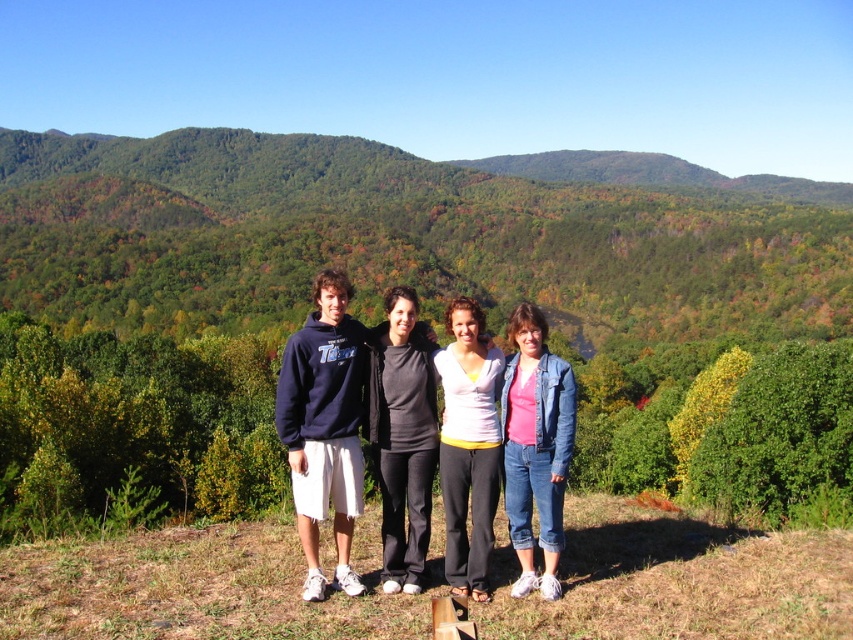
Who is taller, pink denim jacket at lower right or dark blue hoodie at center?

Standing taller between the two is dark blue hoodie at center.

Measure the distance between point [531,356] and camera.

The distance of point [531,356] from camera is 29.39 feet.

This screenshot has width=853, height=640. In order to click on pink denim jacket at lower right in this screenshot , I will do `click(535, 448)`.

Does green leafy hillside at center have a larger size compared to pink denim jacket at lower right?

Indeed, green leafy hillside at center has a larger size compared to pink denim jacket at lower right.

What do you see at coordinates (393, 236) in the screenshot? I see `green leafy hillside at center` at bounding box center [393, 236].

The width and height of the screenshot is (853, 640). I want to click on green leafy hillside at center, so click(393, 236).

I want to click on green leafy hillside at center, so click(x=393, y=236).

Does point (752, 294) lie in front of point (384, 420)?

No, it is not.

Does green leafy hillside at center have a lesser width compared to black matte pants at center?

No, green leafy hillside at center is not thinner than black matte pants at center.

Locate an element on the screen. green leafy hillside at center is located at coordinates click(x=393, y=236).

This screenshot has width=853, height=640. Find the location of `green leafy hillside at center`. green leafy hillside at center is located at coordinates (393, 236).